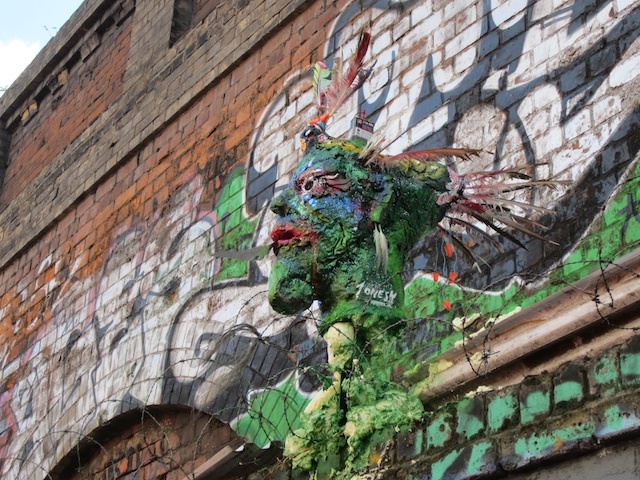
Image resolution: width=640 pixels, height=480 pixels. I want to click on sculpture of head with feathers, so click(353, 228).